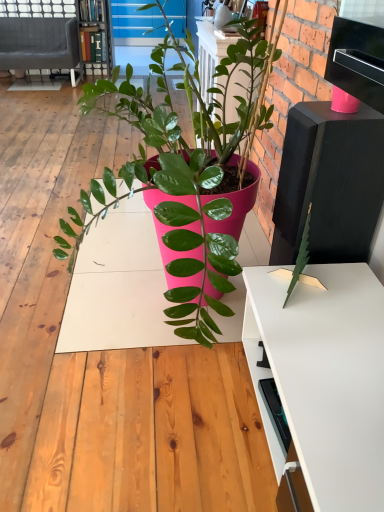
Question: Is wooden bookshelf at upper left oriented away from velvet grey couch at upper left?

Choices:
 (A) no
 (B) yes

Answer: (A)

Question: Does wooden bookshelf at upper left have a lesser height compared to velvet grey couch at upper left?

Choices:
 (A) yes
 (B) no

Answer: (B)

Question: Is wooden bookshelf at upper left positioned before velvet grey couch at upper left?

Choices:
 (A) no
 (B) yes

Answer: (A)

Question: Considering the relative sizes of wooden bookshelf at upper left and velvet grey couch at upper left in the image provided, is wooden bookshelf at upper left thinner than velvet grey couch at upper left?

Choices:
 (A) no
 (B) yes

Answer: (B)

Question: From a real-world perspective, is wooden bookshelf at upper left positioned over velvet grey couch at upper left based on gravity?

Choices:
 (A) no
 (B) yes

Answer: (B)

Question: Is velvet grey couch at upper left inside wooden bookshelf at upper left?

Choices:
 (A) no
 (B) yes

Answer: (A)

Question: Does velvet grey couch at upper left lie behind wooden bookshelf at upper left?

Choices:
 (A) no
 (B) yes

Answer: (A)

Question: Does velvet grey couch at upper left appear on the left side of wooden bookshelf at upper left?

Choices:
 (A) no
 (B) yes

Answer: (B)

Question: From the image's perspective, does velvet grey couch at upper left appear higher than wooden bookshelf at upper left?

Choices:
 (A) yes
 (B) no

Answer: (B)

Question: Is velvet grey couch at upper left facing away from wooden bookshelf at upper left?

Choices:
 (A) no
 (B) yes

Answer: (A)

Question: Is velvet grey couch at upper left thinner than wooden bookshelf at upper left?

Choices:
 (A) no
 (B) yes

Answer: (A)

Question: Is velvet grey couch at upper left positioned far away from wooden bookshelf at upper left?

Choices:
 (A) no
 (B) yes

Answer: (A)

Question: Visually, is velvet grey couch at upper left positioned to the left or to the right of wooden bookshelf at upper left?

Choices:
 (A) left
 (B) right

Answer: (A)